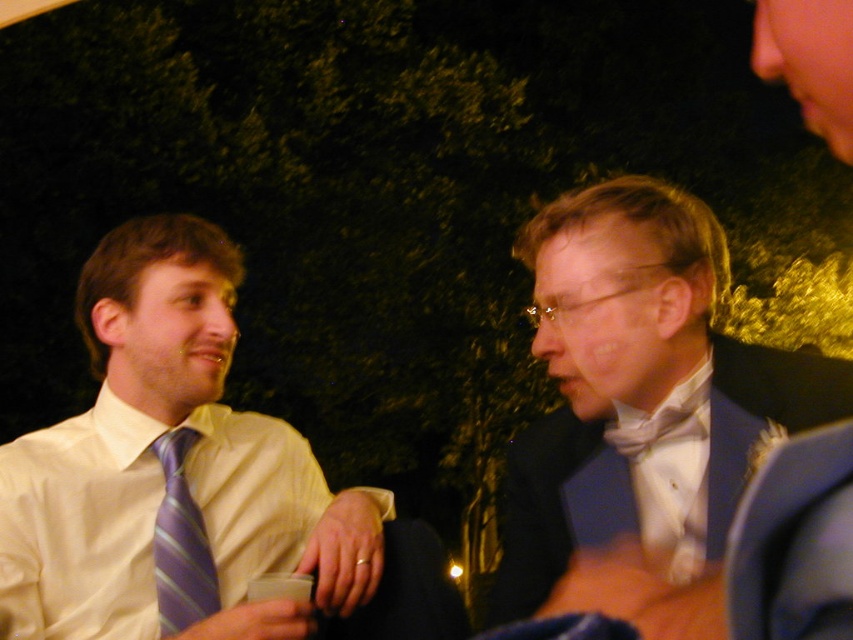
Which is more to the right, white satin shirt at left or white satin bow tie at center?

Positioned to the right is white satin bow tie at center.

Is point (70, 611) farther from viewer compared to point (618, 417)?

Yes.

The image size is (853, 640). I want to click on white satin shirt at left, so click(x=170, y=468).

Does white satin dress shirt at center have a lesser width compared to purple striped tie at left?

In fact, white satin dress shirt at center might be wider than purple striped tie at left.

Which of these two, white satin dress shirt at center or purple striped tie at left, stands shorter?

With less height is white satin dress shirt at center.

At what (x,y) coordinates should I click in order to perform the action: click on white satin dress shirt at center. Please return your answer as a coordinate pair (x, y). Looking at the image, I should click on [666, 476].

Is shiny blue suit at center positioned before white satin bow tie at center?

Yes, shiny blue suit at center is closer to the viewer.

Who is more forward, (x=688, y=340) or (x=631, y=449)?

Point (x=688, y=340)

Does point (546, 460) come in front of point (627, 422)?

No, (546, 460) is behind (627, 422).

In order to click on shiny blue suit at center in this screenshot , I will do `click(637, 406)`.